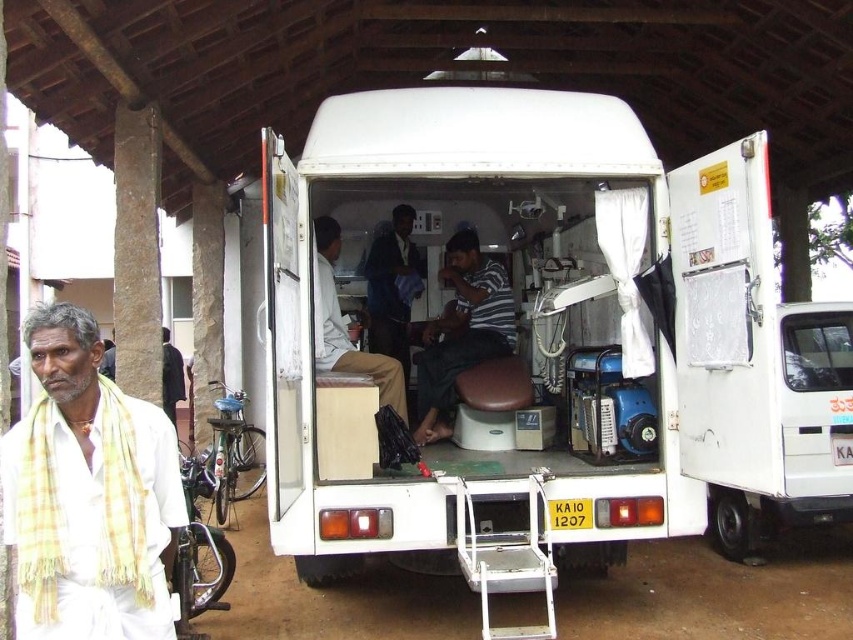
Can you confirm if white cotton shirt at center is bigger than dark blue shirt at center?

Correct, white cotton shirt at center is larger in size than dark blue shirt at center.

Does point (328, 312) lie in front of point (374, 314)?

Yes, it is.

Where is `white cotton shirt at center`? This screenshot has width=853, height=640. white cotton shirt at center is located at coordinates (346, 326).

Between white plastic van at center and white cotton shirt at center, which one has less height?

With less height is white cotton shirt at center.

Does white plastic van at center appear under white cotton shirt at center?

No.

Who is more forward, (351, 227) or (399, 384)?

Point (399, 384)

Identify the location of white plastic van at center. Image resolution: width=853 pixels, height=640 pixels. (547, 340).

Is point (482, 266) more distant than point (387, 396)?

That is True.

Does striped cotton shirt at center appear under white cotton shirt at center?

Yes.

Which is behind, point (421, 371) or point (323, 232)?

Positioned behind is point (421, 371).

You are a GUI agent. You are given a task and a screenshot of the screen. Output one action in this format:
    pyautogui.click(x=<x>, y=<y>)
    Task: Click on the striped cotton shirt at center
    The image size is (853, 640).
    Given the screenshot: What is the action you would take?
    pyautogui.click(x=462, y=332)